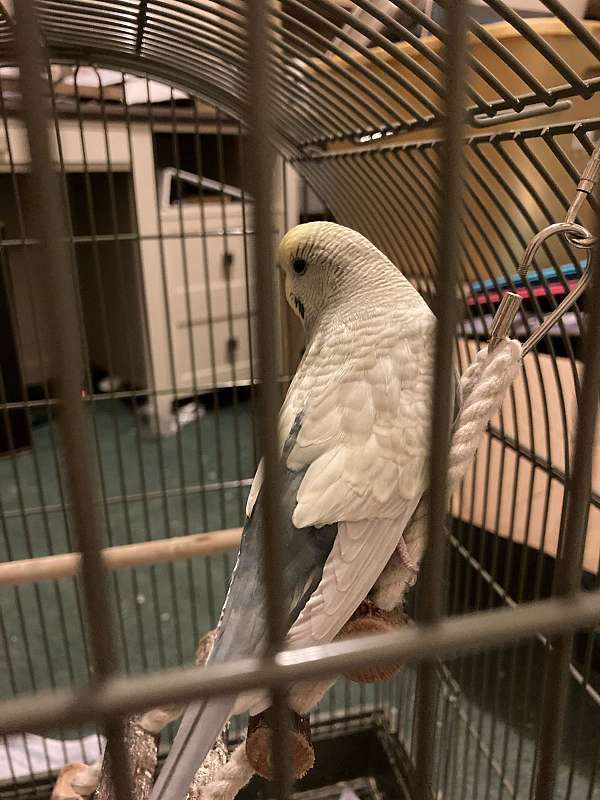
Where is `metal hook`? metal hook is located at coordinates (555, 314).